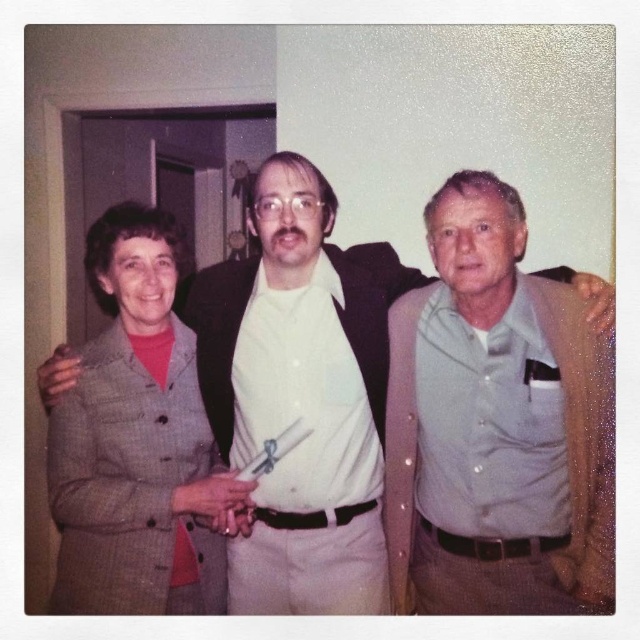
You are a GUI agent. You are given a task and a screenshot of the screen. Output one action in this format:
    pyautogui.click(x=<x>, y=<y>)
    Task: Click on the gray wool suit at center
    
    Given the screenshot: What is the action you would take?
    pyautogui.click(x=412, y=416)

Between point (461, 545) and point (470, 433), which one is positioned behind?

Positioned behind is point (461, 545).

Image resolution: width=640 pixels, height=640 pixels. In order to click on gray wool suit at center in this screenshot , I will do `click(412, 416)`.

Does gray cotton shirt at center have a greater height compared to gray woolen suit at left?

Indeed, gray cotton shirt at center has a greater height compared to gray woolen suit at left.

Who is more distant from viewer, (477, 355) or (122, 388)?

The point (122, 388) is more distant.

Identify the location of gray cotton shirt at center. coord(496,426).

Between gray wool suit at center and gray woolen suit at left, which one is positioned lower?

gray wool suit at center is lower down.

Between gray wool suit at center and gray woolen suit at left, which one is positioned higher?

gray woolen suit at left is above.

Does point (432, 448) lie in front of point (170, 260)?

That is True.

Where is `gray wool suit at center`? This screenshot has height=640, width=640. gray wool suit at center is located at coordinates (412, 416).